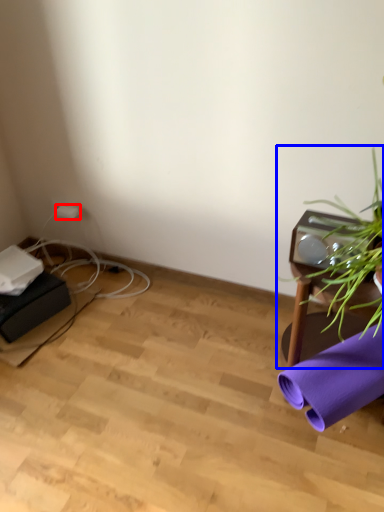
Question: Which point is closer to the camera, plug (highlighted by a red box) or houseplant (highlighted by a blue box)?

Choices:
 (A) plug
 (B) houseplant

Answer: (B)